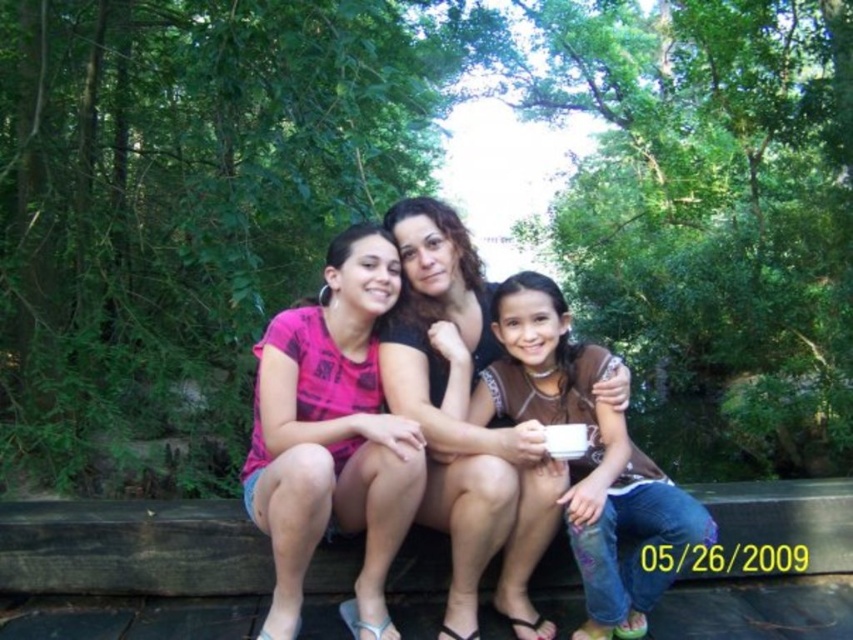
Question: Is pink fabric shirt at center thinner than matte black shirt at center?

Choices:
 (A) yes
 (B) no

Answer: (B)

Question: Among these points, which one is farthest from the camera?

Choices:
 (A) click(512, 525)
 (B) click(312, 401)
 (C) click(635, 596)

Answer: (B)

Question: From the image, what is the correct spatial relationship of pink fabric shirt at center in relation to matte black shirt at center?

Choices:
 (A) left
 (B) right

Answer: (A)

Question: Among these points, which one is farthest from the camera?

Choices:
 (A) (358, 406)
 (B) (606, 563)

Answer: (A)

Question: Which object is positioned farthest from the matte black shirt at center?

Choices:
 (A) brown matte shirt at center
 (B) pink fabric shirt at center

Answer: (B)

Question: Can you confirm if matte black shirt at center is positioned to the left of brown matte shirt at center?

Choices:
 (A) yes
 (B) no

Answer: (A)